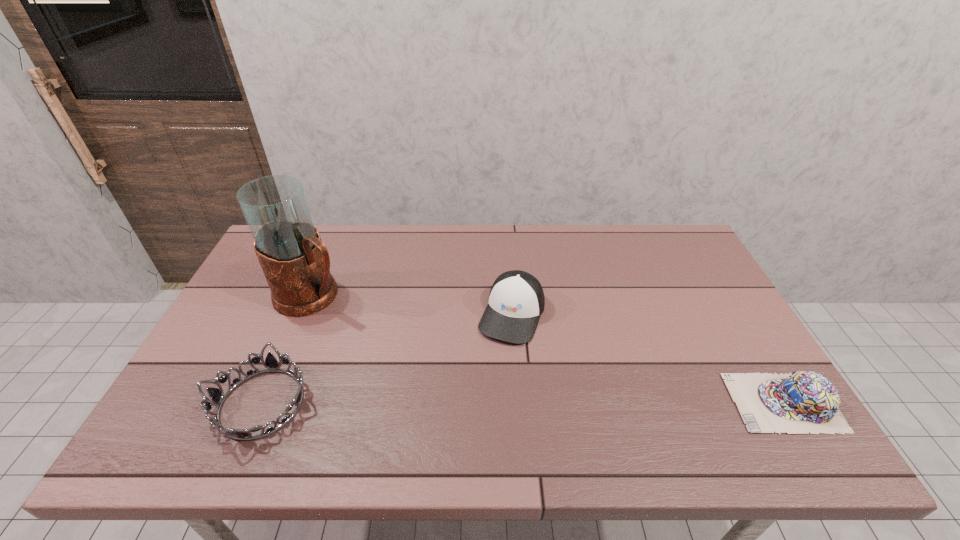
The width and height of the screenshot is (960, 540). What are the coordinates of `vacant region located on the front panel of the third object from left to right` in the screenshot? It's located at (480, 399).

The image size is (960, 540). In order to click on vacant space located on the front panel of the third object from left to right in this screenshot , I will do `click(475, 409)`.

Where is `free space located 0.240m with the handle on the side of the tallest object`? This screenshot has height=540, width=960. free space located 0.240m with the handle on the side of the tallest object is located at coordinates (402, 342).

Where is `vacant point located with the handle on the side of the tallest object`? This screenshot has height=540, width=960. vacant point located with the handle on the side of the tallest object is located at coordinates (425, 355).

I want to click on free space located 0.120m with the handle on the side of the tallest object, so coord(371,324).

Locate an element on the screen. The height and width of the screenshot is (540, 960). tiara present at the near edge is located at coordinates click(217, 396).

This screenshot has width=960, height=540. I want to click on cap that is at the near edge, so click(x=800, y=402).

What are the coordinates of `tiara at the left edge` in the screenshot? It's located at (217, 396).

I want to click on pitcher positioned at the left edge, so click(296, 264).

Locate an element on the screen. The width and height of the screenshot is (960, 540). object that is at the right edge is located at coordinates (800, 402).